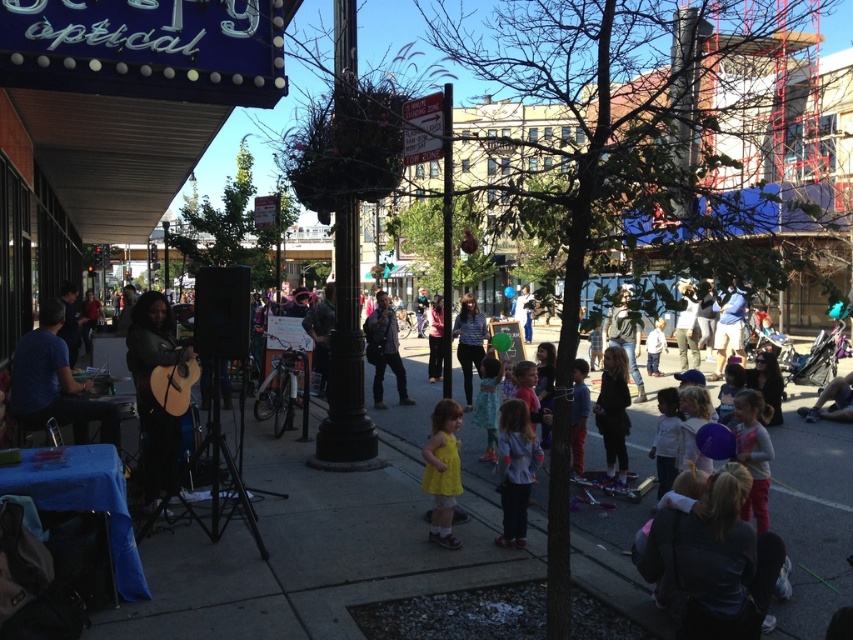
You are a photographer standing at the edge of the lively street scene. You want to capture a photo that includes both the yellow matte dress at center and the light pink fabric dress at lower right. Given the distance between them, do you think you can fit both into your camera frame without moving closer or farther away?

The distance between the yellow matte dress at center and the light pink fabric dress at lower right is 7.23 feet. Depending on your camera lens and field of view, it might be possible to capture both in the frame without adjusting your position, but this would require a wide enough angle to accommodate the 7.23 feet separation between them.

You are a photographer trying to capture a photo of the matte black guitar at left and the light purple shirt at center. Which object should you zoom in more on to ensure both are clearly visible in the frame?

You should zoom in more on the light purple shirt at center because the matte black guitar at left is bigger than the light purple shirt at center, so zooming in on the smaller object will help balance their sizes in the photo.